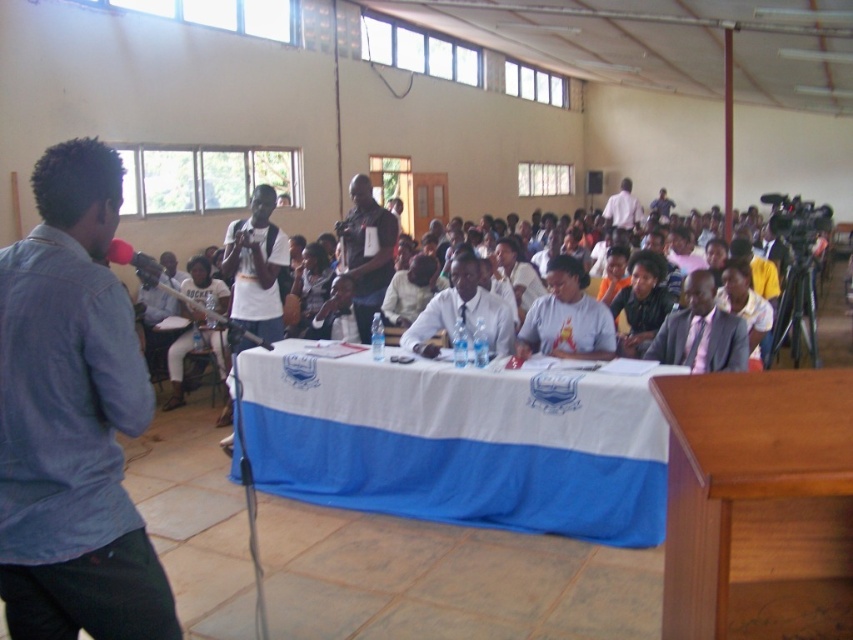
Between wooden podium at lower right and white glossy shirt at center, which one is positioned higher?

Positioned higher is white glossy shirt at center.

Does wooden podium at lower right have a larger size compared to white glossy shirt at center?

Incorrect, wooden podium at lower right is not larger than white glossy shirt at center.

Is point (817, 628) positioned after point (418, 321)?

That is False.

Locate an element on the screen. Image resolution: width=853 pixels, height=640 pixels. wooden podium at lower right is located at coordinates pos(758,506).

Can you confirm if dark blue shirt at center is bigger than white shirt at center?

Indeed, dark blue shirt at center has a larger size compared to white shirt at center.

Which is below, dark blue shirt at center or white shirt at center?

Positioned lower is dark blue shirt at center.

Locate an element on the screen. Image resolution: width=853 pixels, height=640 pixels. dark blue shirt at center is located at coordinates (366, 252).

Which of these two, blue fabric table at center or blue denim shirt at left, stands taller?

With more height is blue denim shirt at left.

Who is shorter, blue fabric table at center or blue denim shirt at left?

With less height is blue fabric table at center.

The width and height of the screenshot is (853, 640). Describe the element at coordinates (459, 444) in the screenshot. I see `blue fabric table at center` at that location.

The height and width of the screenshot is (640, 853). I want to click on blue fabric table at center, so click(x=459, y=444).